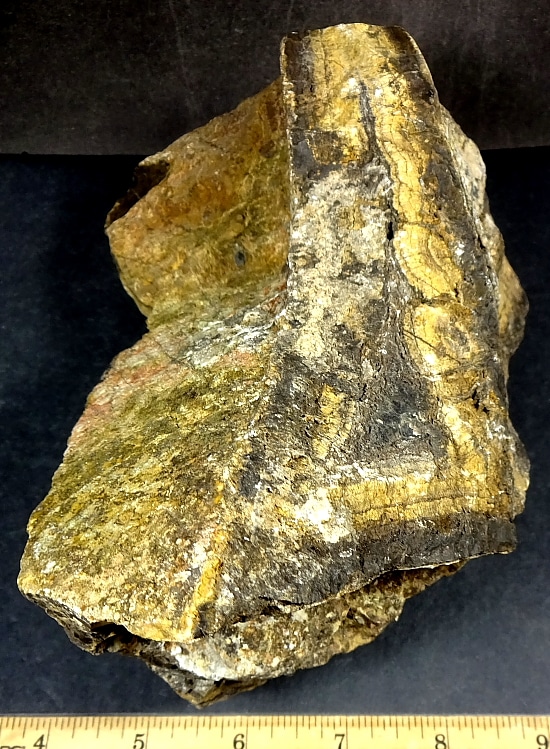
In order to click on black tabletop in this screenshot , I will do `click(444, 640)`.